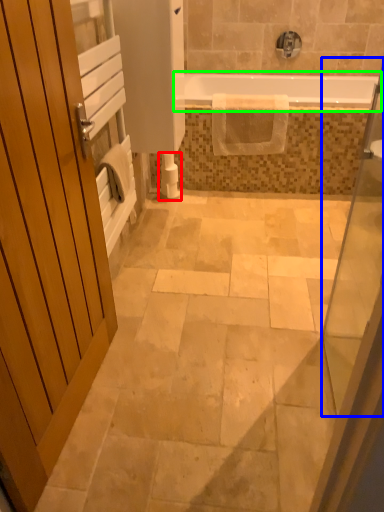
Question: Which object is positioned closest to toilet paper (highlighted by a red box)? Select from glass door (highlighted by a blue box) and bathtub (highlighted by a green box).

Choices:
 (A) glass door
 (B) bathtub

Answer: (B)